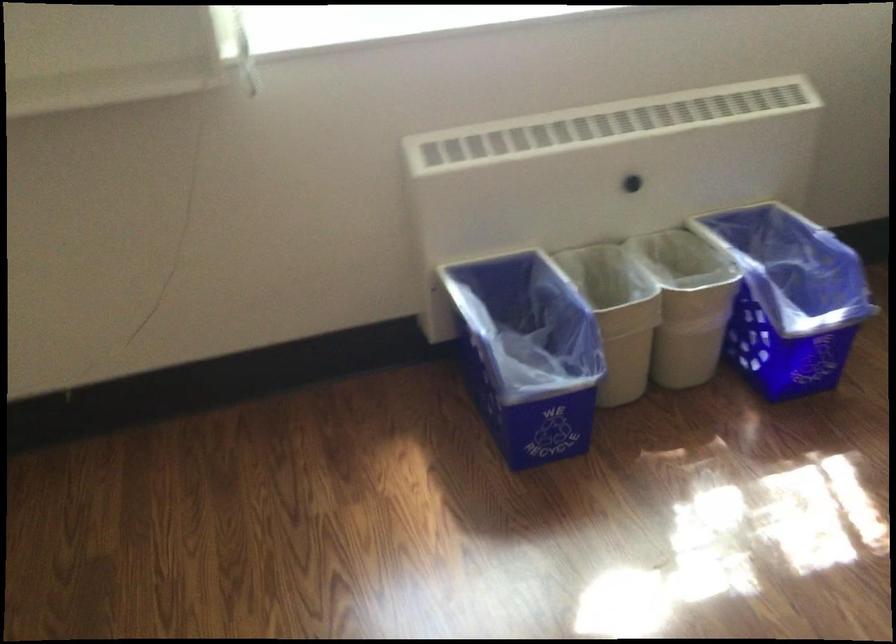
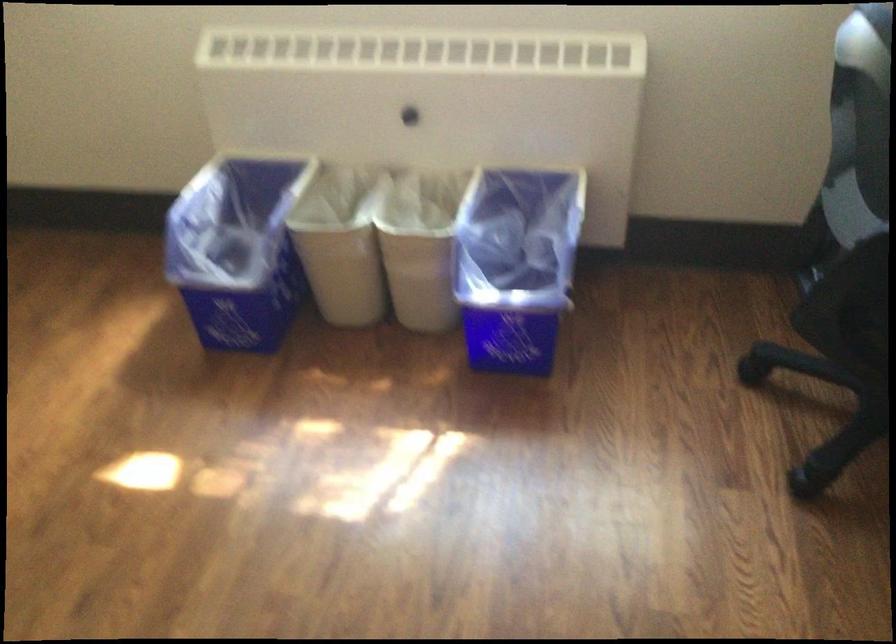
Locate, in the second image, the point that corresponds to (755,297) in the first image.

(515, 265)